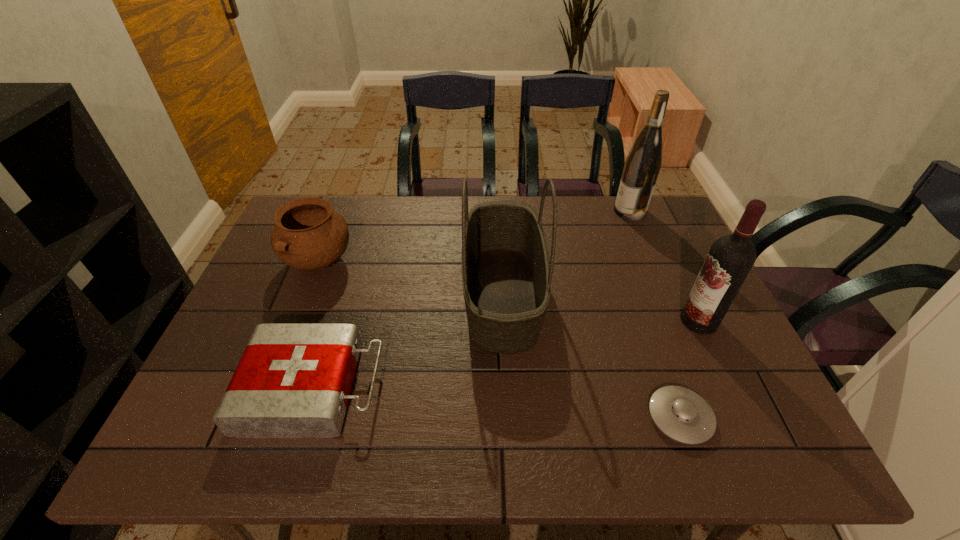
I want to click on the farther wine bottle, so click(x=643, y=163).

Find the location of a particular element. The width and height of the screenshot is (960, 540). the nearer wine bottle is located at coordinates (731, 257).

You are a GUI agent. You are given a task and a screenshot of the screen. Output one action in this format:
    pyautogui.click(x=<x>, y=<y>)
    Task: Click on the third object from left to right
    
    Given the screenshot: What is the action you would take?
    pyautogui.click(x=506, y=277)

At what (x,y) coordinates should I click in order to perform the action: click on the third shortest object. Please return your answer as a coordinate pair (x, y). The height and width of the screenshot is (540, 960). Looking at the image, I should click on (308, 235).

Where is `the fifth tallest object`? The image size is (960, 540). the fifth tallest object is located at coordinates (293, 380).

Image resolution: width=960 pixels, height=540 pixels. In order to click on the shortest object in this screenshot , I will do `click(681, 414)`.

Where is `vacant space located on the left of the farthest object`? This screenshot has width=960, height=540. vacant space located on the left of the farthest object is located at coordinates (588, 211).

At what (x,y) coordinates should I click in order to perform the action: click on vacant space located 0.280m on the label of the nearer wine bottle. Please return your answer as a coordinate pair (x, y). Image resolution: width=960 pixels, height=540 pixels. Looking at the image, I should click on (571, 321).

Where is `blank area located 0.050m on the label of the nearer wine bottle`? blank area located 0.050m on the label of the nearer wine bottle is located at coordinates (661, 321).

Find the location of a particular element. vacant space located 0.350m on the label of the nearer wine bottle is located at coordinates (544, 321).